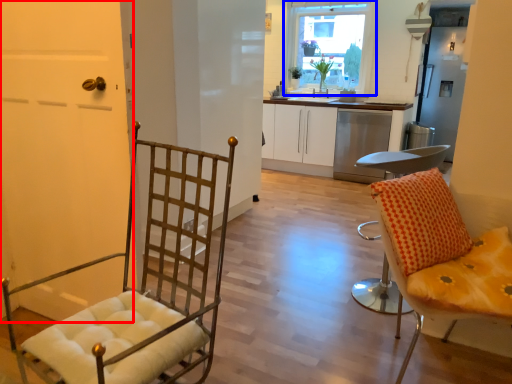
Question: Among these objects, which one is nearest to the camera, door (highlighted by a red box) or window (highlighted by a blue box)?

Choices:
 (A) door
 (B) window

Answer: (A)